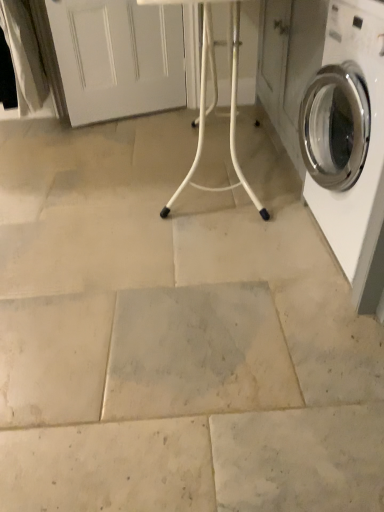
Question: Relative to white plastic table at center, is white glossy washing machine at right in front or behind?

Choices:
 (A) front
 (B) behind

Answer: (A)

Question: Considering the positions of white glossy washing machine at right and white plastic table at center in the image, is white glossy washing machine at right taller or shorter than white plastic table at center?

Choices:
 (A) tall
 (B) short

Answer: (B)

Question: From a real-world perspective, is white glossy washing machine at right physically located above or below white plastic table at center?

Choices:
 (A) above
 (B) below

Answer: (B)

Question: Is point (192, 0) positioned closer to the camera than point (329, 179)?

Choices:
 (A) closer
 (B) farther

Answer: (B)

Question: In the image, is white plastic table at center on the left side or the right side of white glossy washing machine at right?

Choices:
 (A) right
 (B) left

Answer: (B)

Question: Based on their sizes in the image, would you say white plastic table at center is bigger or smaller than white glossy washing machine at right?

Choices:
 (A) small
 (B) big

Answer: (B)

Question: Considering the positions of white plastic table at center and white glossy washing machine at right in the image, is white plastic table at center taller or shorter than white glossy washing machine at right?

Choices:
 (A) tall
 (B) short

Answer: (A)